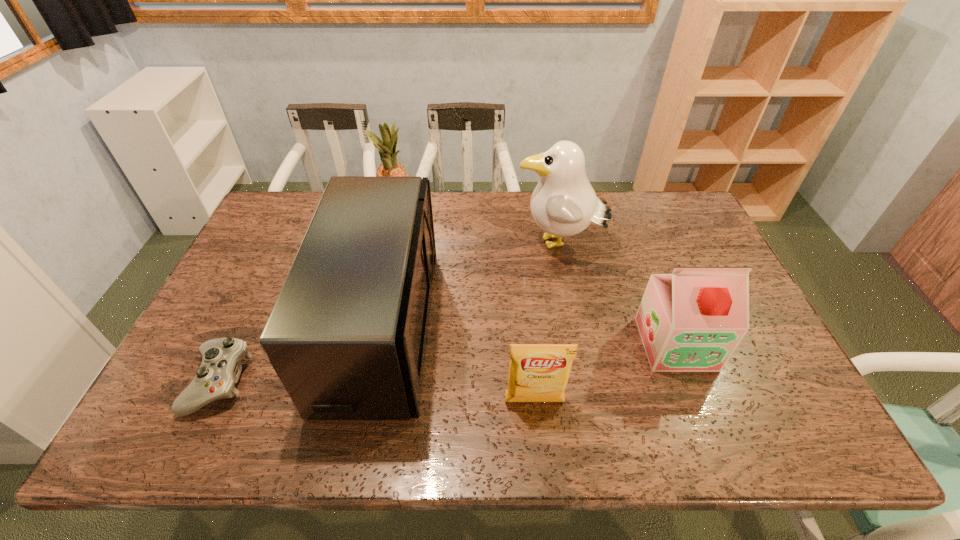
The image size is (960, 540). Find the location of `blank region between the rightmost object and the crisp (potato chip)`. blank region between the rightmost object and the crisp (potato chip) is located at coordinates (605, 373).

The image size is (960, 540). I want to click on free space between the gull and the second shortest object, so click(x=546, y=323).

Locate an element on the screen. This screenshot has height=540, width=960. vacant point located between the microwave_oven and the soya milk is located at coordinates (529, 335).

Identify which object is located as the fourth nearest to the microwave_oven. Please provide its 2D coordinates. Your answer should be formatted as a tuple, i.e. [(x, y)], where the tuple contains the x and y coordinates of a point satisfying the conditions above.

[(563, 204)]

Choose which object is the nearest neighbor to the microwave_oven. Please provide its 2D coordinates. Your answer should be formatted as a tuple, i.e. [(x, y)], where the tuple contains the x and y coordinates of a point satisfying the conditions above.

[(387, 149)]

This screenshot has width=960, height=540. What are the coordinates of `blank area in the image that satisfies the following two spatial constraints: 1. on the beak of the gull; 2. on the front of the crisp (potato chip) with the logo` in the screenshot? It's located at (588, 402).